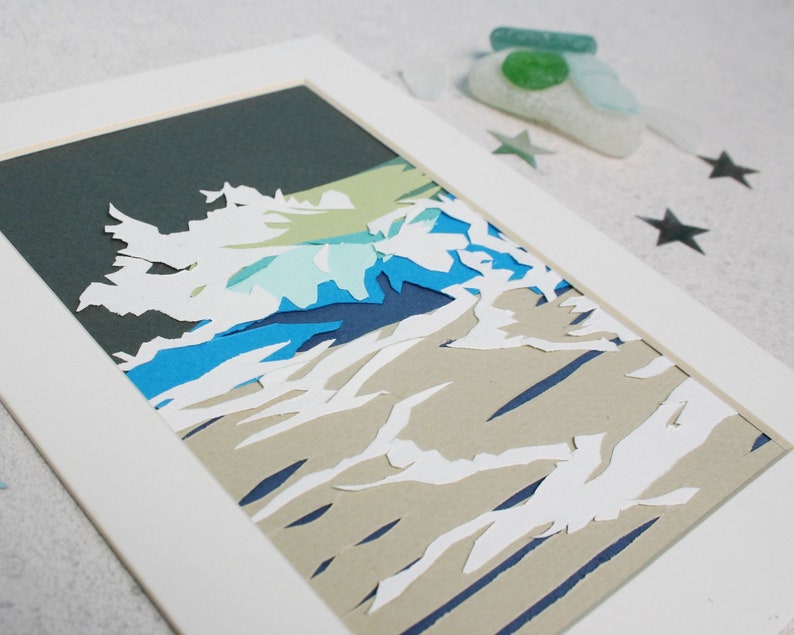
Locate an element on the screen. The image size is (794, 635). white frame is located at coordinates (598, 270).